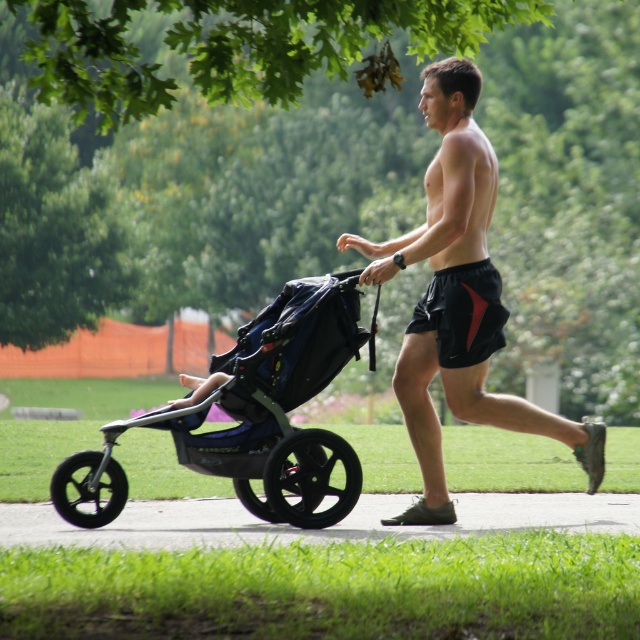
You are a photographer trying to capture the man jogging with the stroller. The black matte shorts at center is represented by point (458, 298). Where should you position your camera to ensure the black matte shorts at center is in the center of the photo?

To center the black matte shorts at center, position the camera so that point (458, 298) is at the photo frame center.

You are a runner who wants to avoid the black rubber pavement at lower center while jogging with your black matte stroller at left. Which direction should you steer the stroller to avoid it?

The black matte stroller at left is currently on the black rubber pavement at lower center. To avoid it, steer the stroller away from the black rubber pavement at lower center towards the grass or other surfaces not mentioned in the scene description.